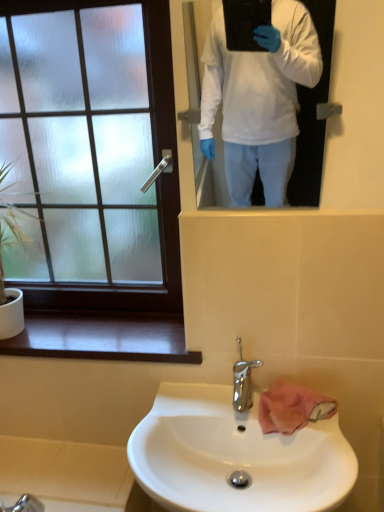
The height and width of the screenshot is (512, 384). What do you see at coordinates (4, 273) in the screenshot?
I see `green leafy plant at left` at bounding box center [4, 273].

Image resolution: width=384 pixels, height=512 pixels. I want to click on white glossy mirror at upper center, so click(x=282, y=97).

Considering the points (184, 23) and (144, 8), which point is behind, point (184, 23) or point (144, 8)?

The point (144, 8) is more distant.

From a real-world perspective, is white glossy mirror at upper center physically located above or below frosted glass window at upper left?

white glossy mirror at upper center is situated higher than frosted glass window at upper left in the real world.

Is white glossy mirror at upper center situated inside frosted glass window at upper left or outside?

white glossy mirror at upper center cannot be found inside frosted glass window at upper left.

Which is more to the left, white glossy mirror at upper center or frosted glass window at upper left?

frosted glass window at upper left.

From a real-world perspective, is white glossy sink at lower center positioned over frosted glass window at upper left based on gravity?

No, from a real-world perspective, white glossy sink at lower center is not on top of frosted glass window at upper left.

Where is `window behind the white glossy sink at lower center`? This screenshot has height=512, width=384. window behind the white glossy sink at lower center is located at coordinates (91, 154).

Are white glossy sink at lower center and frosted glass window at upper left far apart?

white glossy sink at lower center is near frosted glass window at upper left, not far away.

Is point (222, 484) closer or farther from the camera than point (50, 59)?

Clearly, point (222, 484) is closer to the camera than point (50, 59).

Considering the relative sizes of chrome metallic faucet at center and frosted glass window at upper left in the image provided, is chrome metallic faucet at center thinner than frosted glass window at upper left?

Incorrect, the width of chrome metallic faucet at center is not less than that of frosted glass window at upper left.

Would you say chrome metallic faucet at center contains frosted glass window at upper left?

Definitely not — frosted glass window at upper left is not inside chrome metallic faucet at center.

Is chrome metallic faucet at center taller or shorter than frosted glass window at upper left?

Clearly, chrome metallic faucet at center is shorter compared to frosted glass window at upper left.

From a real-world perspective, is chrome metallic faucet at center below frosted glass window at upper left?

Yes, from a real-world perspective, chrome metallic faucet at center is under frosted glass window at upper left.

Does frosted glass window at upper left have a greater width compared to white glossy sink at lower center?

Incorrect, the width of frosted glass window at upper left does not surpass that of white glossy sink at lower center.

Which point is more distant from viewer, (68, 231) or (268, 440)?

The point (68, 231) is behind.

From the image's perspective, who appears lower, frosted glass window at upper left or white glossy sink at lower center?

From the image's view, white glossy sink at lower center is below.

I want to click on sink on the left of the chrome metallic faucet at center, so click(x=236, y=455).

Is point (307, 440) farther from viewer compared to point (256, 360)?

That is False.

From their relative heights in the image, would you say white glossy sink at lower center is taller or shorter than chrome metallic faucet at center?

white glossy sink at lower center is taller than chrome metallic faucet at center.

I want to click on sink in front of the pink fabric hand towel at sink, so click(236, 455).

From a real-world perspective, which object stands above the other?

In real-world perspective, pink fabric hand towel at sink is above.

Is pink fabric hand towel at sink spatially inside white glossy sink at lower center, or outside of it?

The correct answer is: inside.

Which object is thinner, pink fabric hand towel at sink or white glossy sink at lower center?

Thinner between the two is pink fabric hand towel at sink.

From a real-world perspective, is chrome metallic faucet at center on white glossy mirror at upper center?

Actually, chrome metallic faucet at center is physically below white glossy mirror at upper center in the real world.

Which is correct: chrome metallic faucet at center is inside white glossy mirror at upper center, or outside of it?

chrome metallic faucet at center is not enclosed by white glossy mirror at upper center.

How many degrees apart are the facing directions of chrome metallic faucet at center and white glossy mirror at upper center?

There is a 1.77-degree angle between the facing directions of chrome metallic faucet at center and white glossy mirror at upper center.

Who is taller, chrome metallic faucet at center or white glossy mirror at upper center?

With more height is white glossy mirror at upper center.

Where is `window that appears on the left of white glossy mirror at upper center`? The width and height of the screenshot is (384, 512). window that appears on the left of white glossy mirror at upper center is located at coordinates point(91,154).

In order to click on window above the white glossy sink at lower center (from the image's perspective) in this screenshot , I will do `click(91, 154)`.

Based on their spatial positions, is white glossy sink at lower center or pink fabric hand towel at sink closer to chrome metallic faucet at center?

pink fabric hand towel at sink is positioned closer to the anchor chrome metallic faucet at center.

Looking at the image, which one is located closer to white glossy sink at lower center, frosted glass window at upper left or white glossy mirror at upper center?

frosted glass window at upper left is closer to white glossy sink at lower center.

From the picture: Based on their spatial positions, is frosted glass window at upper left or pink fabric hand towel at sink further from green leafy plant at left?

The object further to green leafy plant at left is pink fabric hand towel at sink.

From the image, which object appears to be nearer to white glossy mirror at upper center, white glossy sink at lower center or pink fabric hand towel at sink?

white glossy sink at lower center lies closer to white glossy mirror at upper center than the other object.

When comparing their distances from pink fabric hand towel at sink, does white glossy sink at lower center or frosted glass window at upper left seem closer?

white glossy sink at lower center.

Considering their positions, is pink fabric hand towel at sink positioned further to white glossy mirror at upper center than white glossy sink at lower center?

pink fabric hand towel at sink.

Considering their positions, is green leafy plant at left positioned further to white glossy sink at lower center than frosted glass window at upper left?

green leafy plant at left is further to white glossy sink at lower center.

Consider the image. Based on their spatial positions, is chrome metallic faucet at center or white glossy sink at lower center closer to white glossy mirror at upper center?

white glossy sink at lower center.

This screenshot has height=512, width=384. I want to click on tap between white glossy mirror at upper center and white glossy sink at lower center from top to bottom, so click(243, 381).

Locate an element on the screen. The width and height of the screenshot is (384, 512). mirror situated between green leafy plant at left and pink fabric hand towel at sink from left to right is located at coordinates (282, 97).

This screenshot has height=512, width=384. I want to click on tap between frosted glass window at upper left and pink fabric hand towel at sink in the vertical direction, so click(x=243, y=381).

This screenshot has height=512, width=384. What are the coordinates of `tap between white glossy mirror at upper center and pink fabric hand towel at sink from top to bottom` in the screenshot? It's located at (243, 381).